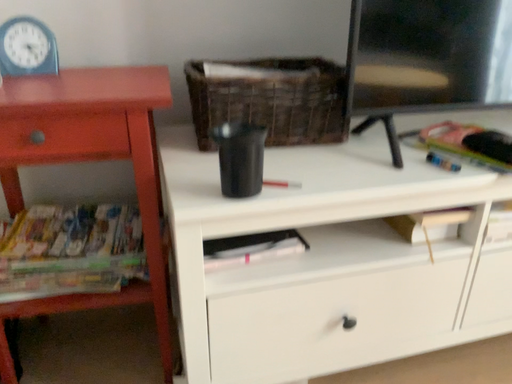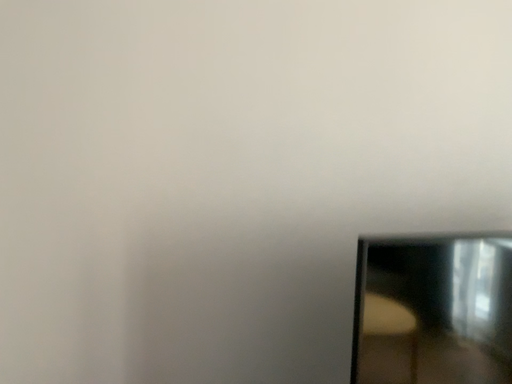
Question: How did the camera likely rotate when shooting the video?

Choices:
 (A) rotated upward
 (B) rotated downward

Answer: (A)